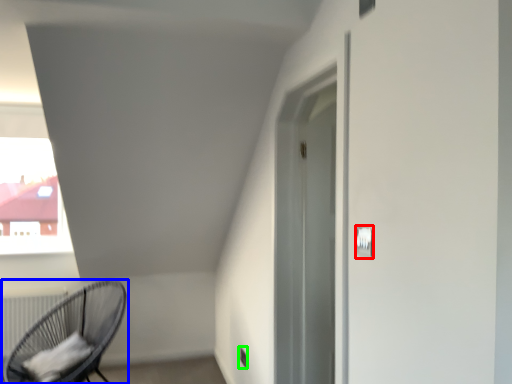
Question: Estimate the real-world distances between objects in this image. Which object is farther from light switch (highlighted by a red box), chair (highlighted by a blue box) or electric outlet (highlighted by a green box)?

Choices:
 (A) chair
 (B) electric outlet

Answer: (A)